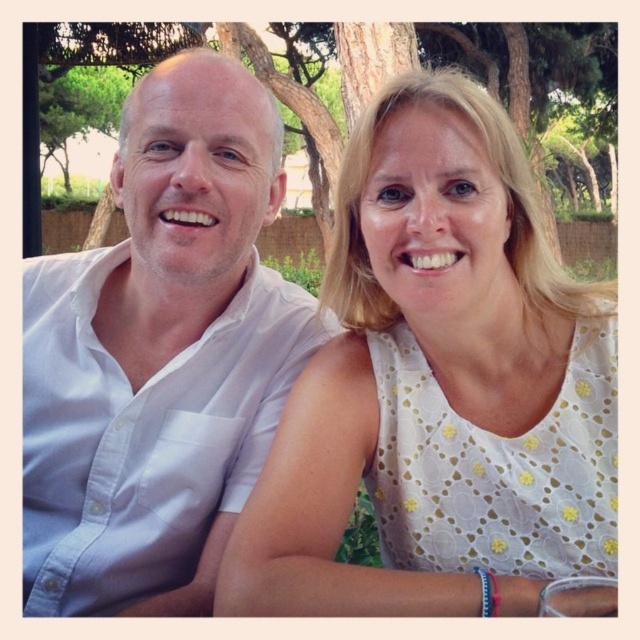
You are a photographer trying to capture a candid shot of the two people at the table. You notice the white dotted dress at center and the green leafy tree at upper center in your viewfinder. Which object is positioned closer to your camera lens?

The white dotted dress at center is closer to the viewer than the green leafy tree at upper center, so the white dotted dress at center will appear closer to the camera lens in the photograph.

You are a photographer setting up a shoot at an outdoor cafe. You need to position two models wearing the white dotted dress at center and the white cotton shirt at left so that their outfits are clearly visible. Given their current positions, which model is positioned lower in the frame?

The white dotted dress at center is positioned lower in the frame than the white cotton shirt at left.